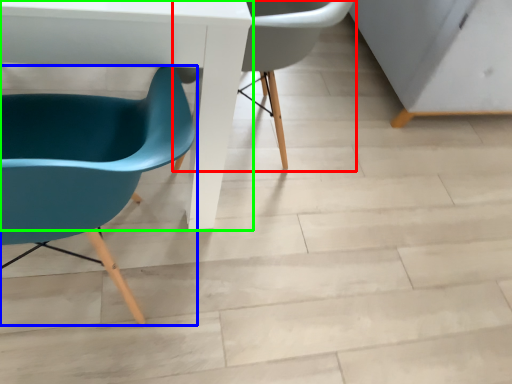
Question: Considering the real-world distances, which object is closest to chair (highlighted by a red box)? chair (highlighted by a blue box) or table (highlighted by a green box).

Choices:
 (A) chair
 (B) table

Answer: (B)